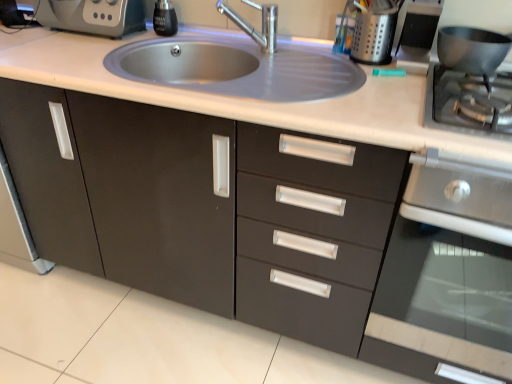
Question: Is stainless steel gas stove at right in front of or behind stainless steel oven at right in the image?

Choices:
 (A) front
 (B) behind

Answer: (B)

Question: Is point (465, 89) closer or farther from the camera than point (496, 284)?

Choices:
 (A) closer
 (B) farther

Answer: (B)

Question: Estimate the real-world distances between objects in this image. Which object is closer to the teal plastic marker at upper right, placed as the second appliance when sorted from left to right?

Choices:
 (A) stainless steel gas stove at right
 (B) satin silver utensil holder at upper right, which is counted as the first appliance, starting from the left
 (C) black glass soap dispenser at upper center
 (D) satin steel sink at center
 (E) stainless steel oven at right

Answer: (B)

Question: Considering the real-world distances, which object is farthest from the metallic gray coffee machine at upper left?

Choices:
 (A) stainless steel gas stove at right
 (B) black glass soap dispenser at upper center
 (C) satin steel sink at center
 (D) stainless steel oven at right
 (E) teal plastic marker at upper right, the second appliance in the right-to-left sequence

Answer: (D)